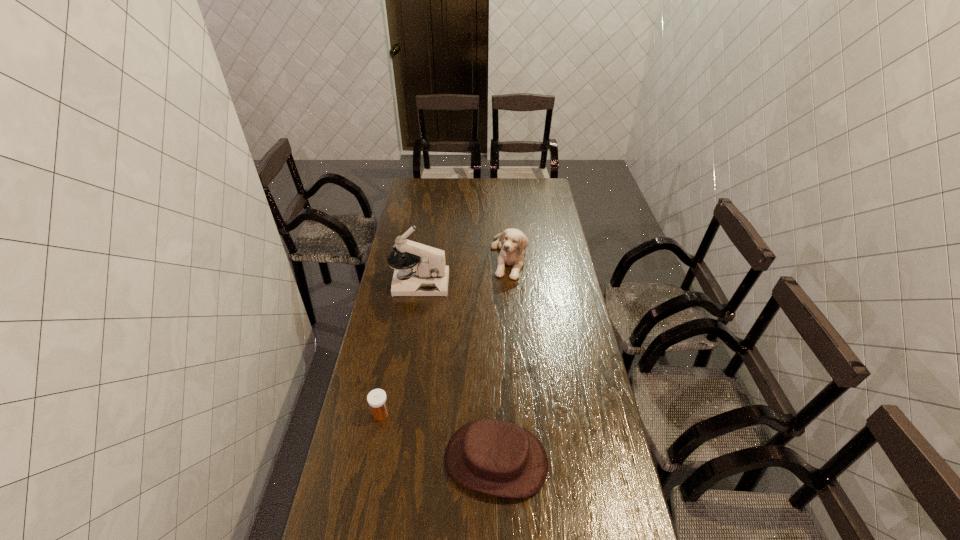
This screenshot has height=540, width=960. In order to click on microscope that is at the left edge in this screenshot , I will do `click(429, 276)`.

Where is `medicine at the left edge`? This screenshot has height=540, width=960. medicine at the left edge is located at coordinates (377, 399).

Image resolution: width=960 pixels, height=540 pixels. What are the coordinates of `free spot at the far edge of the desktop` in the screenshot? It's located at (496, 198).

In the image, there is a desktop. Where is `vacant space at the left edge`? The height and width of the screenshot is (540, 960). vacant space at the left edge is located at coordinates (414, 217).

You are a GUI agent. You are given a task and a screenshot of the screen. Output one action in this format:
    pyautogui.click(x=<x>, y=<y>)
    Task: Click on the vacant area at the right edge
    Image resolution: width=960 pixels, height=540 pixels.
    Given the screenshot: What is the action you would take?
    pyautogui.click(x=569, y=497)

Identify the location of vacant area at the far right corner. (543, 191).

Identify the location of blank region between the puppy and the second nearest object. The height and width of the screenshot is (540, 960). (444, 335).

At what (x,y) coordinates should I click in order to perform the action: click on free space between the nearest object and the medicine. Please return your answer as a coordinate pair (x, y). The width and height of the screenshot is (960, 540). Looking at the image, I should click on (439, 437).

The image size is (960, 540). What are the coordinates of `free spot between the second nearest object and the tallest object` in the screenshot? It's located at (400, 348).

Locate an element on the screen. The image size is (960, 540). unoccupied position between the second nearest object and the tallest object is located at coordinates (400, 348).